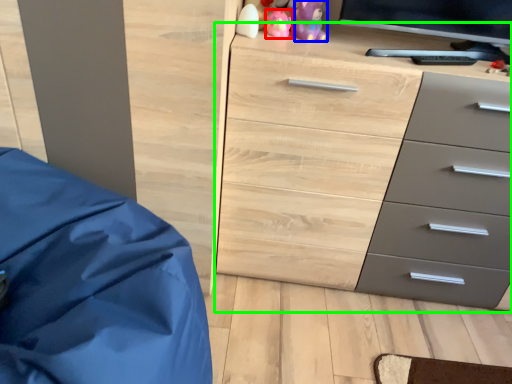
Question: Which object is the farthest from toy (highlighted by a red box)? Choose among these: toy (highlighted by a blue box) or chest of drawers (highlighted by a green box).

Choices:
 (A) toy
 (B) chest of drawers

Answer: (B)